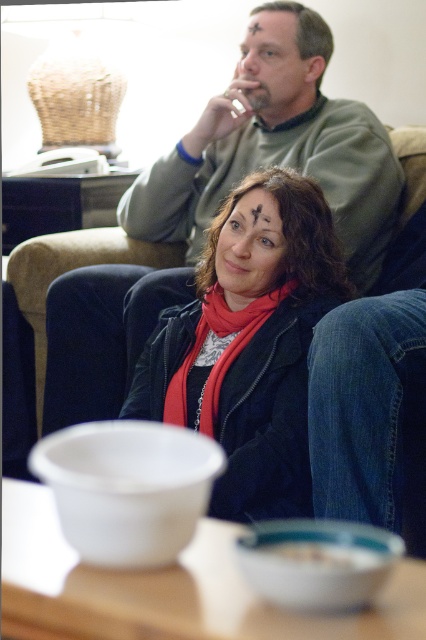
You are standing in the living room and want to place a small decorative item exactly at point (236, 125). If the item is 1 foot in diameter, will it fit without overlapping any objects?

The distance between the viewer and point (236, 125) is 6.28 feet. Since the item is only 1 foot in diameter, there is sufficient space for it to be placed at that point without overlapping any objects.

You are a photographer trying to capture a closeup of the person in the foreground. You notice two points marked in the image at coordinates point (126, 289) and point (204, 344). Which point should you focus on to ensure the foreground person is in sharp focus?

Point (126, 289) is further to the camera than point (204, 344), so you should focus on point (126, 289) to ensure the foreground person is in sharp focus.

You are designing a layout for a magazine cover and need to place two items from the image. The matte green sweater at center and the red matte scarf at center must be arranged vertically. Which item should be placed higher up to maintain their original spatial relationship?

The matte green sweater at center should be placed higher up since it is much taller than the red matte scarf at center in the original image.